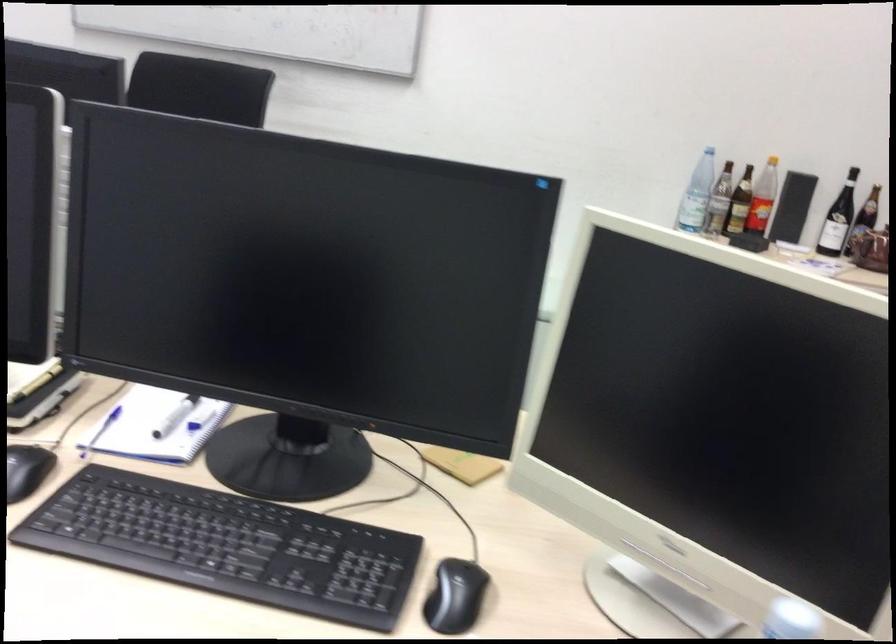
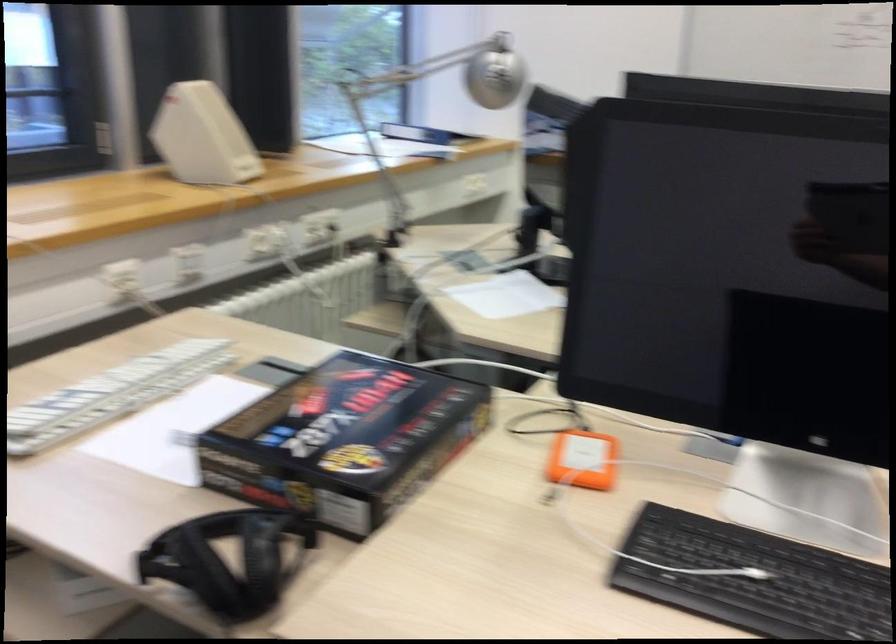
Question: How did the camera likely rotate?

Choices:
 (A) Left
 (B) Right
 (C) Up
 (D) Down

Answer: (A)